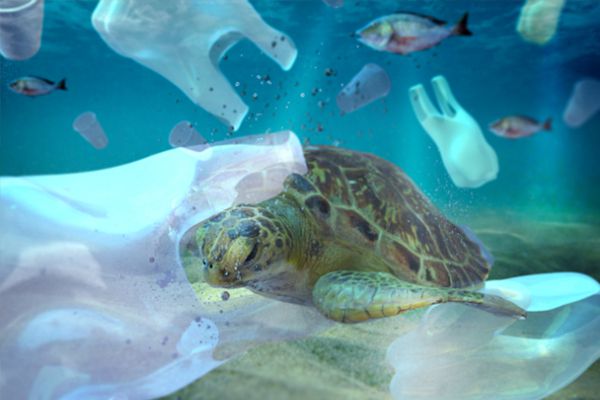
You are a GUI agent. You are given a task and a screenshot of the screen. Output one action in this format:
    pyautogui.click(x=<x>, y=<y>)
    Task: Click on the plastic cup
    The width and height of the screenshot is (600, 400).
    Given the screenshot: What is the action you would take?
    pyautogui.click(x=26, y=54)